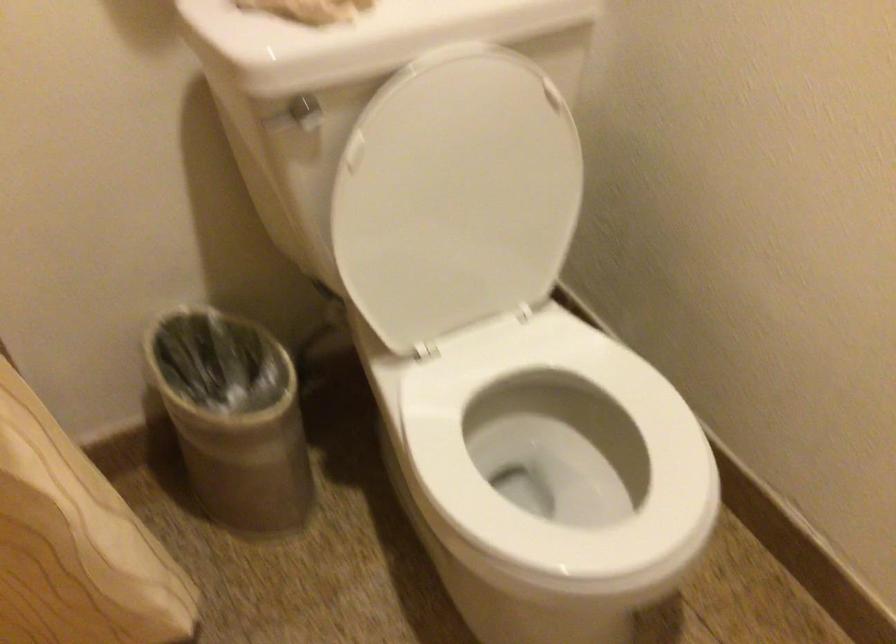
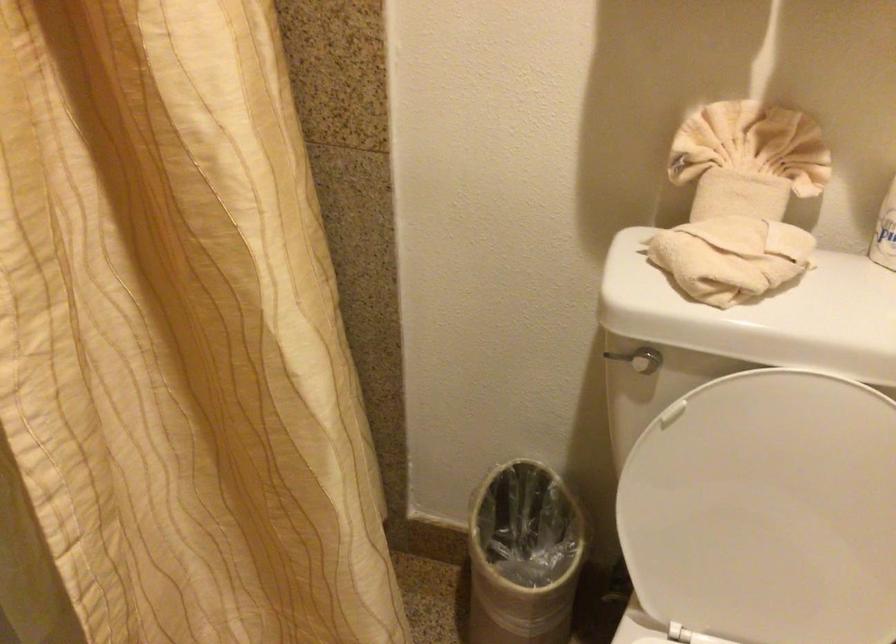
Where in the second image is the point corresponding to point (276, 128) from the first image?

(616, 357)